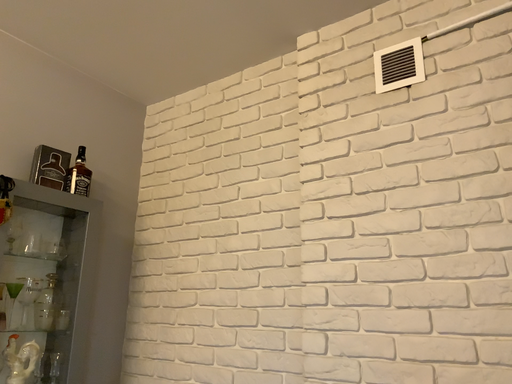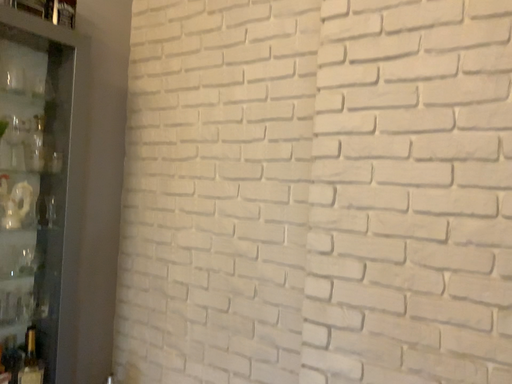
Question: Which way did the camera rotate in the video?

Choices:
 (A) rotated upward
 (B) rotated downward

Answer: (B)